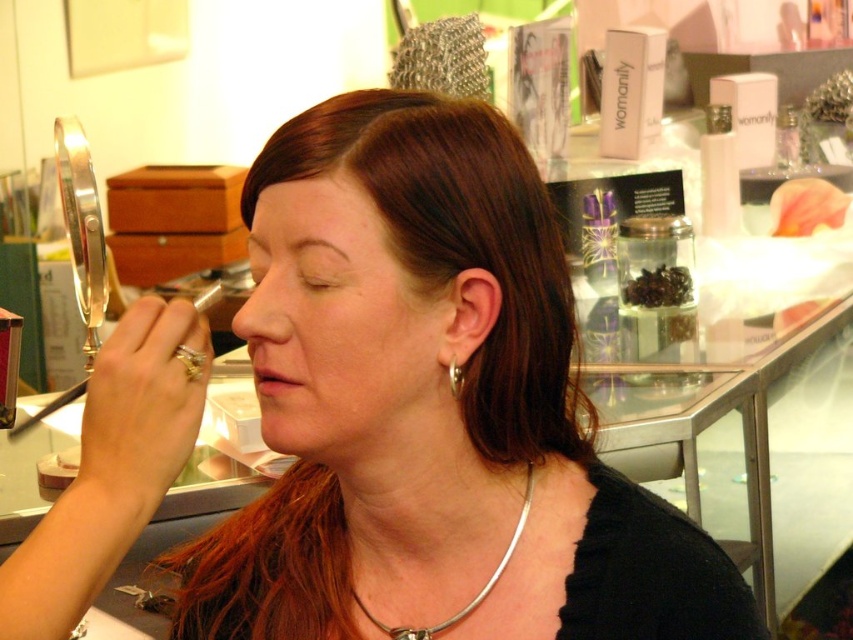
Question: Does silver metallic necklace at center appear on the left side of gold shiny earring at ear?

Choices:
 (A) yes
 (B) no

Answer: (B)

Question: Which object is closer to the camera taking this photo?

Choices:
 (A) gold shiny earring at ear
 (B) silver metallic necklace at center

Answer: (A)

Question: Is silver metallic necklace at center to the left of gold shiny earring at ear from the viewer's perspective?

Choices:
 (A) yes
 (B) no

Answer: (B)

Question: Among these points, which one is nearest to the camera?

Choices:
 (A) (450, 624)
 (B) (462, 381)

Answer: (B)

Question: Which point is farther to the camera?

Choices:
 (A) gold shiny earring at ear
 (B) silver metallic necklace at center

Answer: (B)

Question: Is silver metallic necklace at center to the left of gold shiny earring at ear from the viewer's perspective?

Choices:
 (A) no
 (B) yes

Answer: (A)